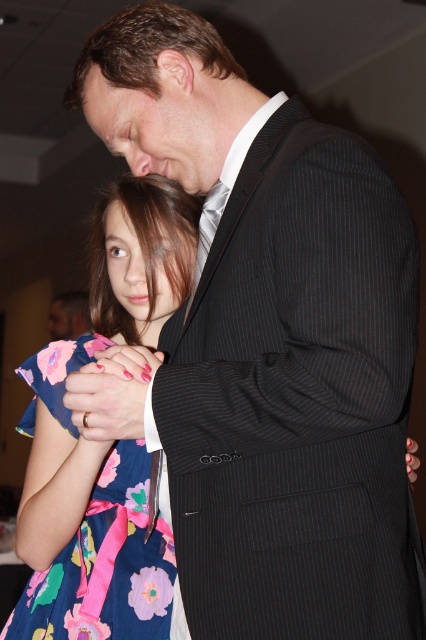
Who is lower down, floral cotton dress at center or matte black suit at upper center?

floral cotton dress at center is lower down.

Does point (155, 580) come in front of point (63, 296)?

Yes, it is.

Find the location of a particular element. Image resolution: width=426 pixels, height=640 pixels. floral cotton dress at center is located at coordinates (106, 564).

Is black pinstripe suit at upper center in front of silky white tie at center?

Yes.

Is point (365, 380) positioned behind point (204, 260)?

That is False.

Which is behind, point (172, 417) or point (215, 202)?

The point (215, 202) is behind.

Locate an element on the screen. black pinstripe suit at upper center is located at coordinates (296, 396).

Who is lower down, black pinstripe suit at upper center or floral cotton dress at center?

floral cotton dress at center

How distant is black pinstripe suit at upper center from floral cotton dress at center?

black pinstripe suit at upper center and floral cotton dress at center are 15.50 inches apart from each other.

Does point (391, 528) come behind point (123, 547)?

No, it is in front of (123, 547).

Identify the location of black pinstripe suit at upper center. The height and width of the screenshot is (640, 426). (296, 396).